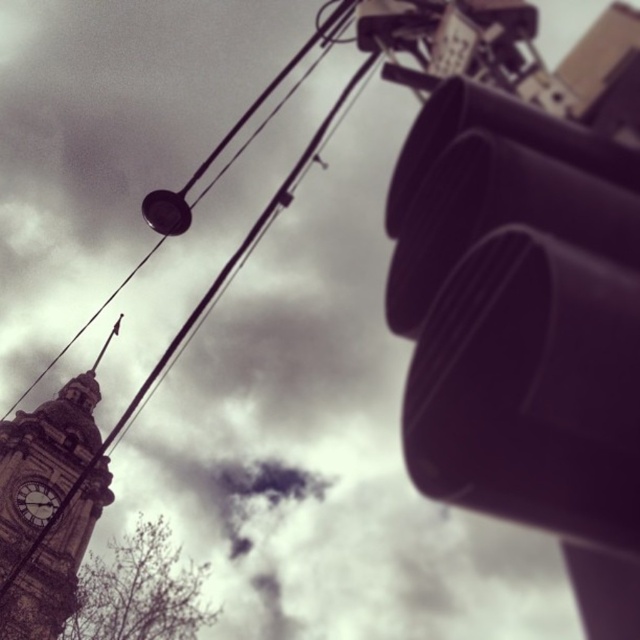
Question: Does black wire at upper left appear on the left side of dark gray stone clock at lower left?

Choices:
 (A) no
 (B) yes

Answer: (A)

Question: Which of these objects is positioned farthest from the black wire at upper left?

Choices:
 (A) dark gray stone clock at lower left
 (B) matte black traffic light at right

Answer: (B)

Question: Which point is closer to the camera taking this photo?

Choices:
 (A) (3, 451)
 (B) (529, 204)

Answer: (B)

Question: Does matte black traffic light at right appear over dark gray stone clock at lower left?

Choices:
 (A) yes
 (B) no

Answer: (A)

Question: Which object is closer to the camera taking this photo?

Choices:
 (A) dark gray stone clock at lower left
 (B) black wire at upper left
 (C) matte black traffic light at right

Answer: (C)

Question: Does matte black traffic light at right have a greater width compared to dark gray stone clock at lower left?

Choices:
 (A) yes
 (B) no

Answer: (A)